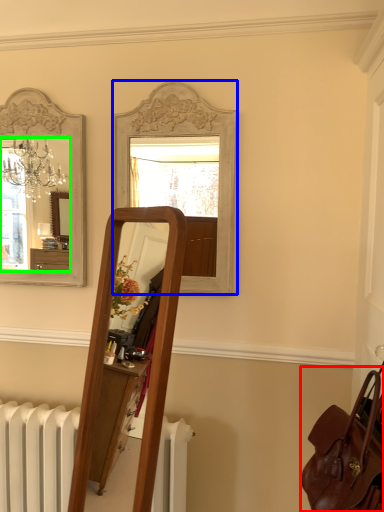
Question: Based on their relative distances, which object is farther from bag (highlighted by a red box)? Choose from mirror (highlighted by a blue box) and mirror (highlighted by a green box).

Choices:
 (A) mirror
 (B) mirror

Answer: (B)